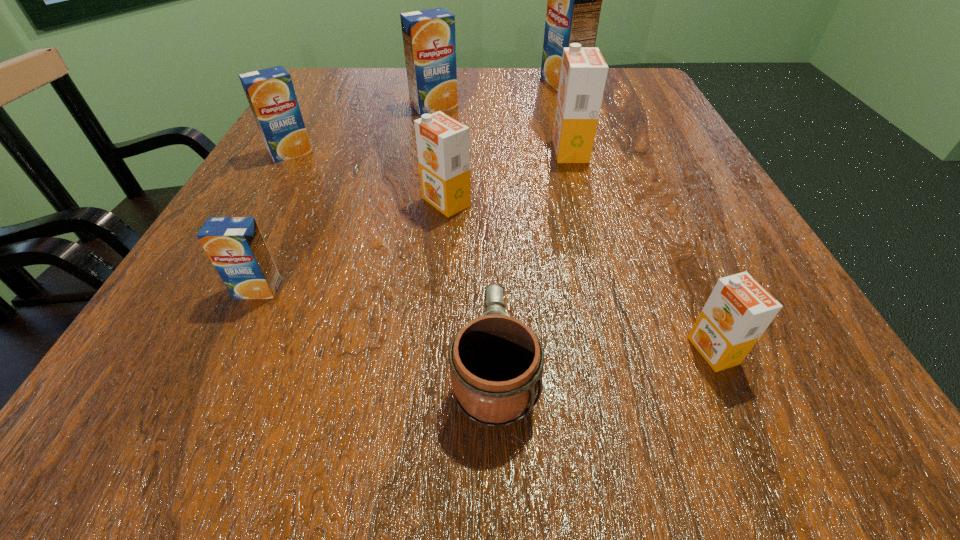
Find the location of a particular element. This screenshot has height=540, width=960. free space that satisfies the following two spatial constraints: 1. on the side of the farthest blue orange_juice with the handle; 2. on the right side of the mug is located at coordinates (487, 83).

I want to click on free space in the image that satisfies the following two spatial constraints: 1. on the front side of the biggest blue orange_juice; 2. on the right side of the rightmost object, so click(648, 350).